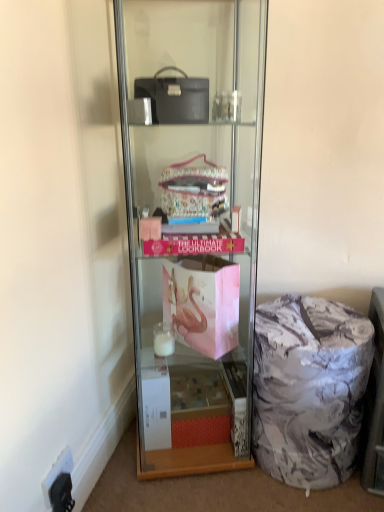
This screenshot has width=384, height=512. What do you see at coordinates (192, 223) in the screenshot?
I see `clear glass shelf at center` at bounding box center [192, 223].

Measure the distance between marble-patterned ottoman at lower right and camera.

marble-patterned ottoman at lower right is 4.71 feet away from camera.

Describe the element at coordinates (375, 404) in the screenshot. I see `marble-patterned ottoman at lower right` at that location.

Identify the location of black plastic electric outlet at lower left. (59, 484).

From a real-world perspective, is marble-patterned fabric bag at lower right positioned under clear glass shelf at center based on gravity?

Yes, from a real-world perspective, marble-patterned fabric bag at lower right is beneath clear glass shelf at center.

Is the depth of marble-patterned fabric bag at lower right greater than that of clear glass shelf at center?

Yes, marble-patterned fabric bag at lower right is further from the camera.

Looking at this image, which of these two, marble-patterned fabric bag at lower right or clear glass shelf at center, stands taller?

Standing taller between the two is clear glass shelf at center.

Is marble-patterned fabric bag at lower right outside of clear glass shelf at center?

Indeed, marble-patterned fabric bag at lower right is completely outside clear glass shelf at center.

Does black plastic electric outlet at lower left turn towards marble-patterned fabric bag at lower right?

No, black plastic electric outlet at lower left is not turned towards marble-patterned fabric bag at lower right.

Does black plastic electric outlet at lower left appear on the left side of marble-patterned fabric bag at lower right?

Indeed, black plastic electric outlet at lower left is positioned on the left side of marble-patterned fabric bag at lower right.

From a real-world perspective, is black plastic electric outlet at lower left below marble-patterned fabric bag at lower right?

Indeed, from a real-world perspective, black plastic electric outlet at lower left is positioned beneath marble-patterned fabric bag at lower right.

Would you say black plastic electric outlet at lower left is outside marble-patterned fabric bag at lower right?

Absolutely, black plastic electric outlet at lower left is external to marble-patterned fabric bag at lower right.

Looking at this image, does clear glass shelf at center contain black plastic electric outlet at lower left?

Actually, black plastic electric outlet at lower left is outside clear glass shelf at center.

Is clear glass shelf at center positioned behind black plastic electric outlet at lower left?

No, it is in front of black plastic electric outlet at lower left.

Are clear glass shelf at center and black plastic electric outlet at lower left far apart?

No, there isn't a large distance between clear glass shelf at center and black plastic electric outlet at lower left.

Which object is positioned more to the right, clear glass shelf at center or black plastic electric outlet at lower left?

clear glass shelf at center.

From a real-world perspective, is black plastic electric outlet at lower left positioned above or below clear glass shelf at center?

From a real-world perspective, black plastic electric outlet at lower left is physically below clear glass shelf at center.

Where is `electric outlet that is below the clear glass shelf at center (from the image's perspective)`? The height and width of the screenshot is (512, 384). electric outlet that is below the clear glass shelf at center (from the image's perspective) is located at coordinates (59, 484).

In terms of height, does black plastic electric outlet at lower left look taller or shorter compared to clear glass shelf at center?

black plastic electric outlet at lower left is shorter than clear glass shelf at center.

Is black plastic electric outlet at lower left not close to clear glass shelf at center?

No, there isn't a large distance between black plastic electric outlet at lower left and clear glass shelf at center.

In the image, is clear glass shelf at center positioned in front of or behind marble-patterned fabric bag at lower right?

Clearly, clear glass shelf at center is in front of marble-patterned fabric bag at lower right.

How many degrees apart are the facing directions of clear glass shelf at center and marble-patterned fabric bag at lower right?

The angle between the facing direction of clear glass shelf at center and the facing direction of marble-patterned fabric bag at lower right is 10.4 degrees.

Is clear glass shelf at center surrounding marble-patterned fabric bag at lower right?

No, marble-patterned fabric bag at lower right is not inside clear glass shelf at center.

From a real-world perspective, is clear glass shelf at center on marble-patterned fabric bag at lower right?

Yes, from a real-world perspective, clear glass shelf at center is above marble-patterned fabric bag at lower right.

Considering the relative sizes of marble-patterned ottoman at lower right and clear glass shelf at center in the image provided, is marble-patterned ottoman at lower right thinner than clear glass shelf at center?

Yes.

In the scene shown: Based on their positions, is marble-patterned ottoman at lower right located to the left or right of clear glass shelf at center?

marble-patterned ottoman at lower right is positioned on clear glass shelf at center's right side.

Which is farther from the camera, (375, 461) or (170, 234)?

Point (375, 461)

Measure the distance from black plastic electric outlet at lower left to marble-patterned ottoman at lower right.

black plastic electric outlet at lower left is 3.43 feet from marble-patterned ottoman at lower right.

Which of these two, black plastic electric outlet at lower left or marble-patterned ottoman at lower right, stands taller?

With more height is marble-patterned ottoman at lower right.

Consider the image. Are black plastic electric outlet at lower left and marble-patterned ottoman at lower right beside each other?

No.

Considering the positions of objects black plastic electric outlet at lower left and marble-patterned ottoman at lower right in the image provided, who is in front, black plastic electric outlet at lower left or marble-patterned ottoman at lower right?

marble-patterned ottoman at lower right is more forward.

At what (x,y) coordinates should I click in order to perform the action: click on shelf that appears above the marble-patterned fabric bag at lower right (from a real-world perspective). Please return your answer as a coordinate pair (x, y). The height and width of the screenshot is (512, 384). Looking at the image, I should click on click(x=192, y=223).

Where is `electric outlet lying below the marble-patterned fabric bag at lower right (from the image's perspective)`? Image resolution: width=384 pixels, height=512 pixels. electric outlet lying below the marble-patterned fabric bag at lower right (from the image's perspective) is located at coordinates (59, 484).

When comparing their distances from marble-patterned fabric bag at lower right, does clear glass shelf at center or black plastic electric outlet at lower left seem further?

black plastic electric outlet at lower left.

From the picture: From the image, which object appears to be farther from marble-patterned fabric bag at lower right, clear glass shelf at center or marble-patterned ottoman at lower right?

clear glass shelf at center is positioned further to the anchor marble-patterned fabric bag at lower right.

Estimate the real-world distances between objects in this image. Which object is further from marble-patterned ottoman at lower right, marble-patterned fabric bag at lower right or black plastic electric outlet at lower left?

The object further to marble-patterned ottoman at lower right is black plastic electric outlet at lower left.

Looking at the image, which one is located further to clear glass shelf at center, marble-patterned fabric bag at lower right or black plastic electric outlet at lower left?

black plastic electric outlet at lower left lies further to clear glass shelf at center than the other object.

Looking at the image, which one is located further to clear glass shelf at center, marble-patterned fabric bag at lower right or marble-patterned ottoman at lower right?

marble-patterned ottoman at lower right is positioned further to the anchor clear glass shelf at center.

Considering their positions, is marble-patterned fabric bag at lower right positioned closer to marble-patterned ottoman at lower right than clear glass shelf at center?

marble-patterned fabric bag at lower right lies closer to marble-patterned ottoman at lower right than the other object.

From the image, which object appears to be nearer to clear glass shelf at center, black plastic electric outlet at lower left or marble-patterned fabric bag at lower right?

marble-patterned fabric bag at lower right.

Looking at the image, which one is located closer to black plastic electric outlet at lower left, clear glass shelf at center or marble-patterned fabric bag at lower right?

Among the two, clear glass shelf at center is located nearer to black plastic electric outlet at lower left.

Identify the location of shelf between black plastic electric outlet at lower left and marble-patterned ottoman at lower right in the horizontal direction. The height and width of the screenshot is (512, 384). (192, 223).

What are the coordinates of `garbage between clear glass shelf at center and marble-patterned ottoman at lower right` in the screenshot? It's located at (309, 389).

You are a GUI agent. You are given a task and a screenshot of the screen. Output one action in this format:
    pyautogui.click(x=<x>, y=<y>)
    Task: Click on the garbage between black plastic electric outlet at lower left and marble-patterned ottoman at lower right
    This screenshot has height=512, width=384.
    Given the screenshot: What is the action you would take?
    pyautogui.click(x=309, y=389)

Identify the location of shelf between black plastic electric outlet at lower left and marble-patterned fabric bag at lower right in the horizontal direction. (192, 223).